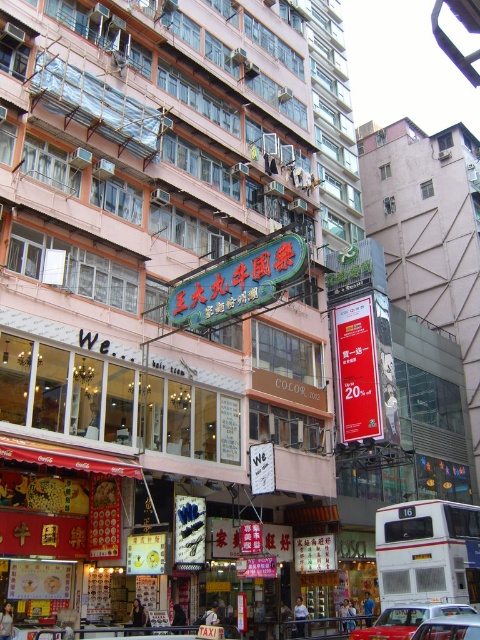
Question: Observing the image, what is the correct spatial positioning of white metallic bus at lower right in reference to shiny red car at lower center?

Choices:
 (A) below
 (B) above

Answer: (B)

Question: Is white metallic bus at lower right bigger than metallic silver car at center?

Choices:
 (A) no
 (B) yes

Answer: (B)

Question: Does shiny red car at lower center appear under metallic silver car at center?

Choices:
 (A) no
 (B) yes

Answer: (B)

Question: Estimate the real-world distances between objects in this image. Which object is farther from the metallic silver car at center?

Choices:
 (A) red paper sign at center
 (B) shiny red car at lower center
 (C) white metallic bus at lower right

Answer: (A)

Question: Among these objects, which one is nearest to the camera?

Choices:
 (A) white metallic bus at lower right
 (B) red paper sign at center
 (C) shiny red car at lower center
 (D) metallic silver car at center

Answer: (D)

Question: Which object is closer to the camera taking this photo?

Choices:
 (A) metallic silver car at center
 (B) red paper sign at center
 (C) shiny red car at lower center
 (D) white metallic bus at lower right

Answer: (A)